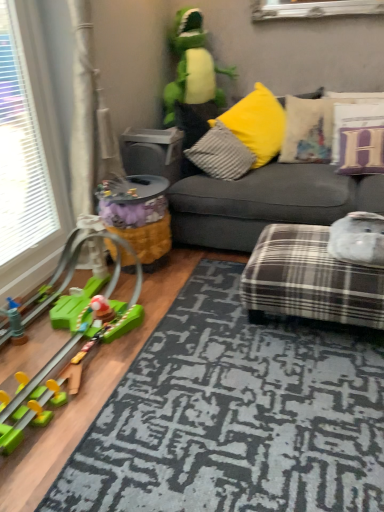
In order to click on free region under dark gray textured rug at lower center (from a real-world perspective) in this screenshot , I will do `click(245, 400)`.